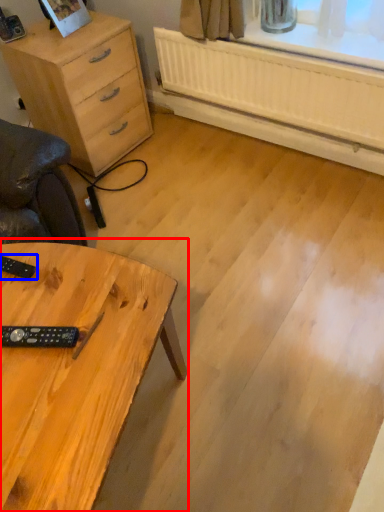
Question: Which of the following is the closest to the observer, table (highlighted by a red box) or control (highlighted by a blue box)?

Choices:
 (A) table
 (B) control

Answer: (A)